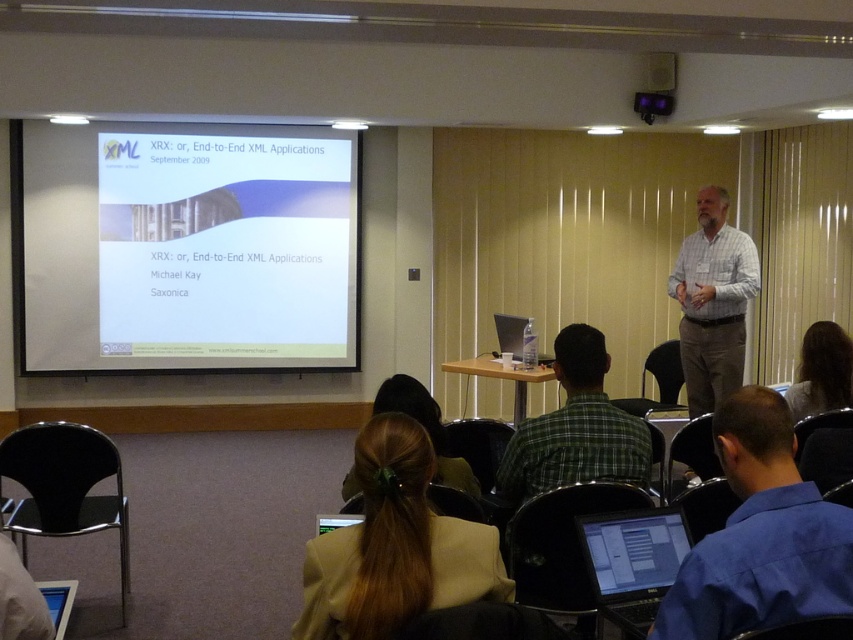
Question: Is brown hair at center to the left of black plastic projector at upper center from the viewer's perspective?

Choices:
 (A) no
 (B) yes

Answer: (B)

Question: Which point appears farthest from the camera in this image?

Choices:
 (A) (770, 589)
 (B) (637, 104)
 (C) (650, 524)
 (D) (273, 310)

Answer: (D)

Question: Which object is positioned closest to the black plastic projector at upper center?

Choices:
 (A) brown hair at center
 (B) white matte projector screen at upper center
 (C) brown hair at upper right
 (D) blue shirt at lower right

Answer: (C)

Question: Is white matte projector screen at upper center bigger than brown hair at center?

Choices:
 (A) yes
 (B) no

Answer: (A)

Question: Does blue shirt at lower right appear over black plastic projector at upper center?

Choices:
 (A) no
 (B) yes

Answer: (A)

Question: Which object is the farthest from the green plaid shirt at center?

Choices:
 (A) matte black laptop at lower center
 (B) brown hair at center

Answer: (A)